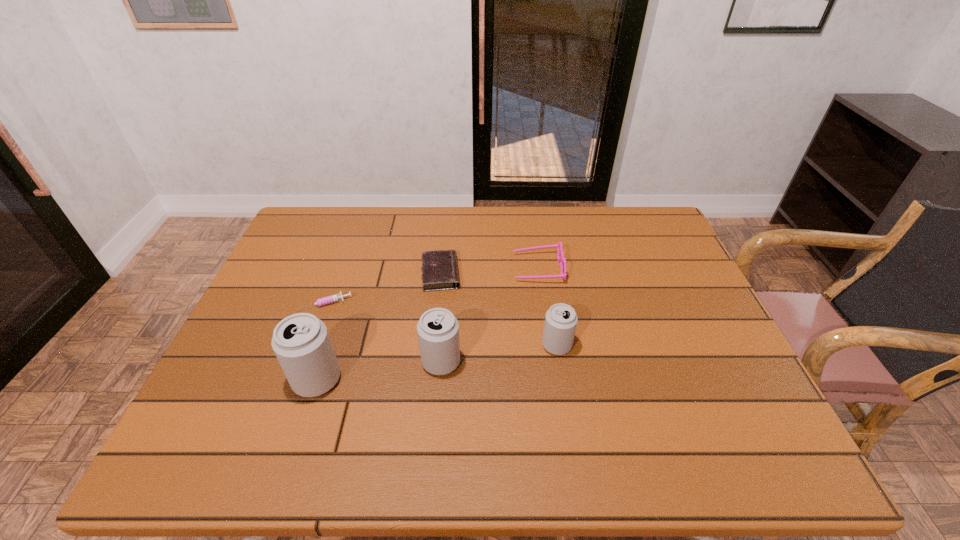
Please point a free position for a can on the right. Please provide its 2D coordinates. Your answer should be formatted as a tuple, i.e. [(x, y)], where the tuple contains the x and y coordinates of a point satisfying the conditions above.

[(664, 330)]